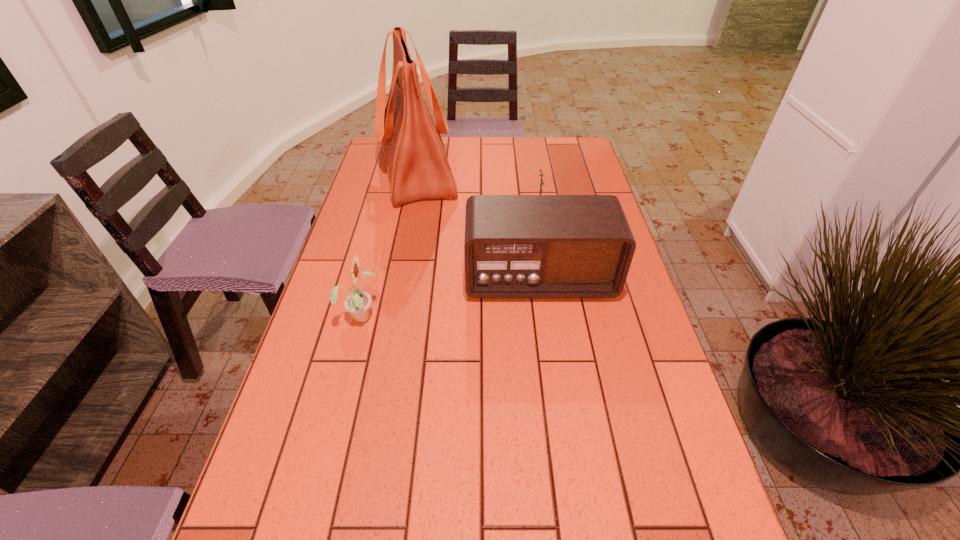
Where is `vacant space that satisfies the following two spatial constraints: 1. on the face of the farther sunflower; 2. on the front-facing side of the radio receiver`? vacant space that satisfies the following two spatial constraints: 1. on the face of the farther sunflower; 2. on the front-facing side of the radio receiver is located at coordinates (547, 279).

This screenshot has width=960, height=540. I want to click on vacant point that satisfies the following two spatial constraints: 1. on the front-facing side of the radio receiver; 2. on the front-facing side of the left sunflower, so click(x=544, y=315).